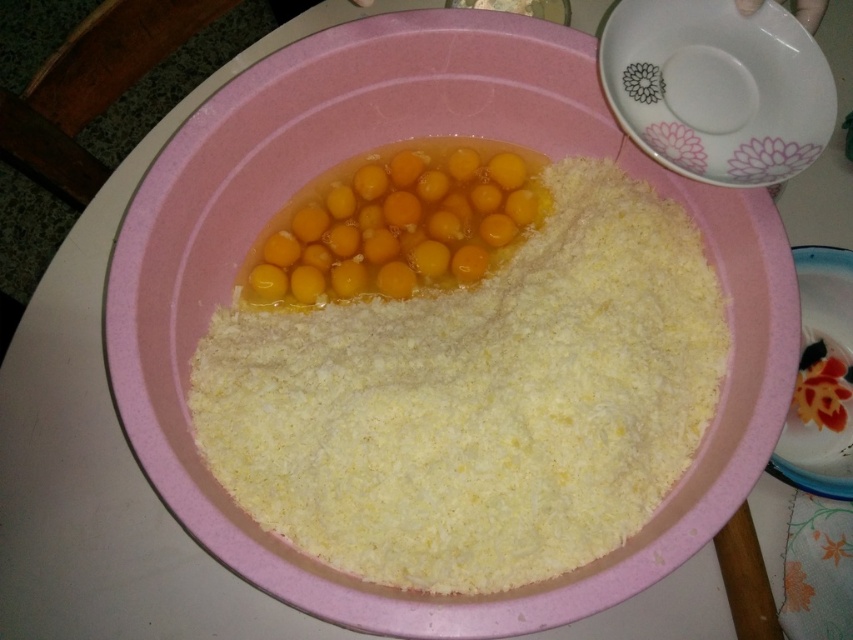
Question: Which of the following is the closest to the observer?

Choices:
 (A) (467, 282)
 (B) (822, 145)
 (C) (561, 179)

Answer: (B)

Question: Which object is closer to the camera taking this photo?

Choices:
 (A) porcelain plate at lower right
 (B) white ceramic plate at upper right

Answer: (B)

Question: Where is white ceramic plate at upper right located in relation to porcelain plate at lower right in the image?

Choices:
 (A) left
 (B) right

Answer: (A)

Question: Is yellow powder at center to the left of white ceramic plate at upper right from the viewer's perspective?

Choices:
 (A) no
 (B) yes

Answer: (B)

Question: Which object is positioned farthest from the yellow/yellowish/golden/yolkish/yellowish/yellowish-golden/yellowish-golden/yellowish-golden/yellowish-golden/yellowish-golden/yellowish-golden/yellowish-golden/yellowish-golden/yellowish-golden/yellowish-golden/yellowish-golden/yellowish-golden/yellowish-golden/yellowish-golden/yellowish-golden/yellowish-golden/yellowish-golden/yellowish-golden/yellowish-golden/y?

Choices:
 (A) porcelain plate at lower right
 (B) yellow powder at center

Answer: (A)

Question: Does yellow/yellowish/golden/yolkish/yellowish/yellowish-golden/yellowish-golden/yellowish-golden/yellowish-golden/yellowish-golden/yellowish-golden/yellowish-golden/yellowish-golden/yellowish-golden/yellowish-golden/yellowish-golden/yellowish-golden/yellowish-golden/yellowish-golden/yellowish-golden/yellowish-golden/yellowish-golden/yellowish-golden/yellowish-golden/y appear on the right side of porcelain plate at lower right?

Choices:
 (A) yes
 (B) no

Answer: (B)